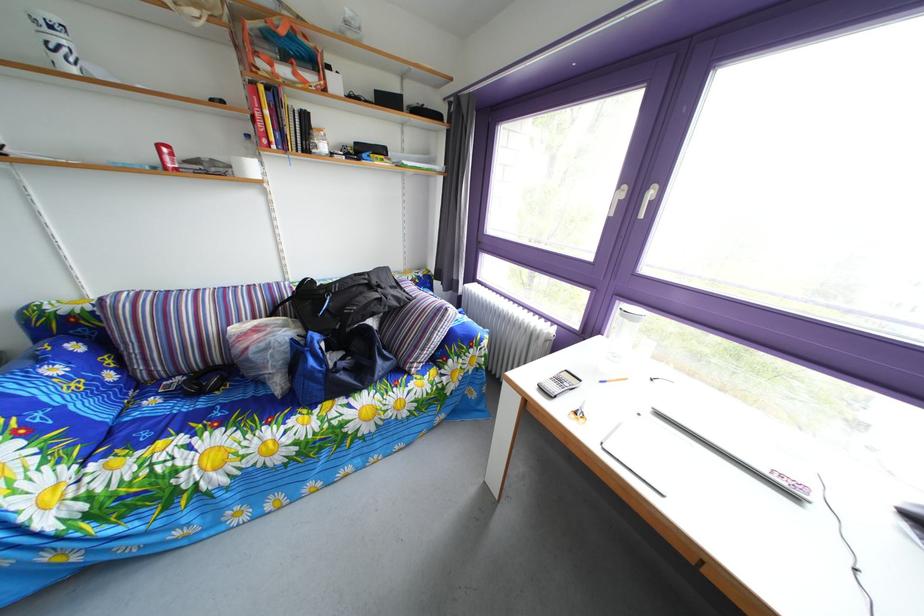
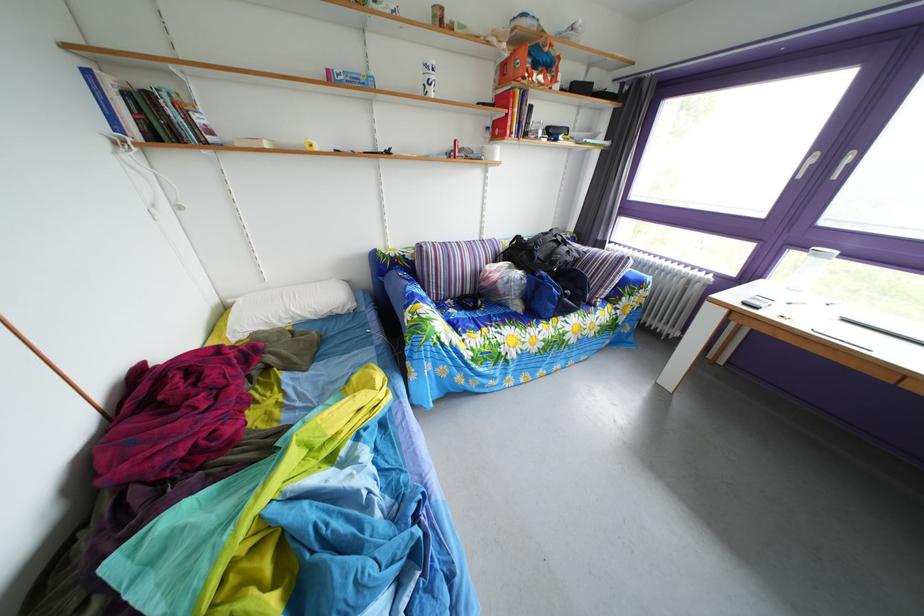
Find the pixel in the second image that matches point (319, 310) in the first image.

(529, 261)